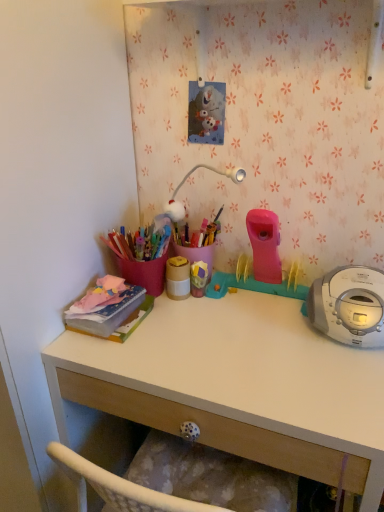
This screenshot has height=512, width=384. I want to click on vacant space to the right of matte pink notebook at left, marked as the 1th office supplies in a left-to-right arrangement, so click(x=183, y=324).